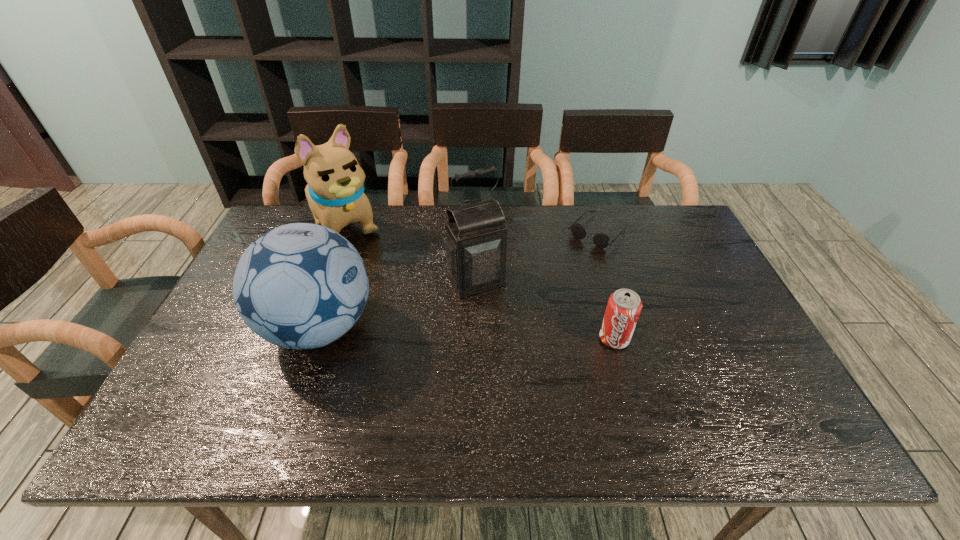
Image resolution: width=960 pixels, height=540 pixels. In order to click on the third tallest object in this screenshot , I will do click(300, 286).

I want to click on the fourth tallest object, so click(624, 306).

Identify the location of puppy. (335, 192).

I want to click on sunglasses, so click(x=601, y=240).

At what (x,y) coordinates should I click in order to perform the action: click on the third object from left to right. Please return your answer as a coordinate pair (x, y). The height and width of the screenshot is (540, 960). Looking at the image, I should click on (476, 234).

This screenshot has width=960, height=540. Identify the location of vacant area located on the side with brand of the third shortest object. (522, 328).

You are a GUI agent. You are given a task and a screenshot of the screen. Output one action in this format:
    pyautogui.click(x=<x>, y=<y>)
    Task: Click on the vacant space situated on the back of the fourth tallest object
    The image size is (960, 540).
    Given the screenshot: What is the action you would take?
    pyautogui.click(x=590, y=253)

Locate an element on the screen. free space located on the face of the puppy is located at coordinates (379, 267).

Find the location of a particular element. This screenshot has height=540, width=960. vacant region located 0.050m on the face of the puppy is located at coordinates (368, 255).

At what (x,y) coordinates should I click in order to perform the action: click on free space located 0.370m on the face of the puppy. Please return your answer as a coordinate pair (x, y). This screenshot has height=540, width=960. Looking at the image, I should click on (424, 316).